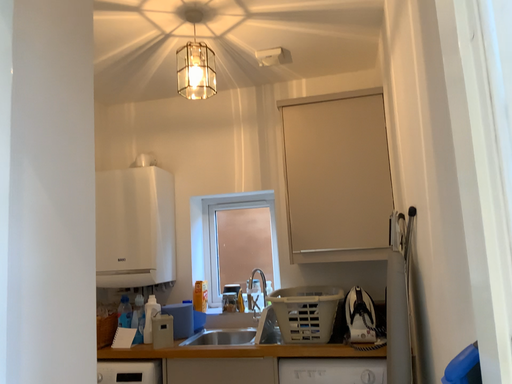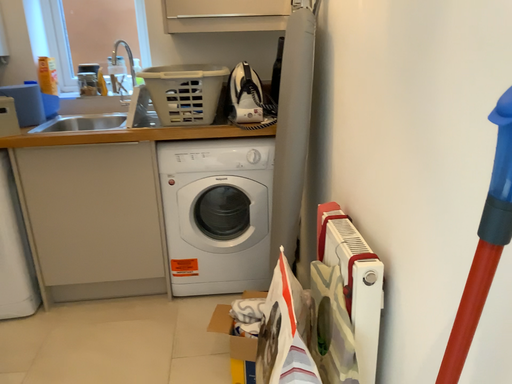
Question: Which way did the camera rotate in the video?

Choices:
 (A) rotated upward
 (B) rotated downward

Answer: (B)